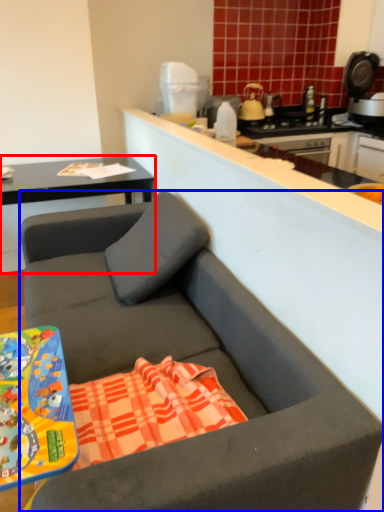
Question: Which object appears closest to the camera in this image, cabinetry (highlighted by a red box) or studio couch (highlighted by a blue box)?

Choices:
 (A) cabinetry
 (B) studio couch

Answer: (B)